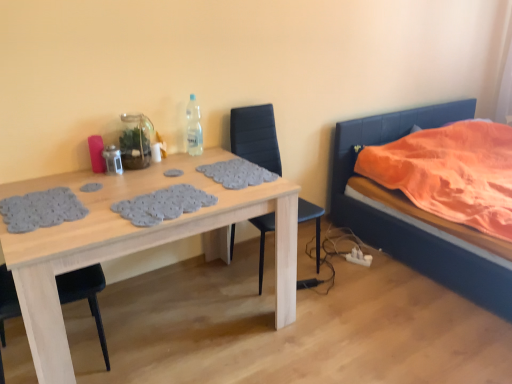
Measure the distance between wooden table at center and camera.

The distance of wooden table at center from camera is 1.38 meters.

The height and width of the screenshot is (384, 512). Describe the element at coordinates (407, 224) in the screenshot. I see `orange fabric bed at right` at that location.

What do you see at coordinates (194, 128) in the screenshot? I see `clear plastic bottle at upper center` at bounding box center [194, 128].

Where is `wooden table at center`? The image size is (512, 384). wooden table at center is located at coordinates (134, 242).

Is wooden table at center not inside clear plastic bottle at upper center?

Absolutely, wooden table at center is external to clear plastic bottle at upper center.

Is wooden table at center oriented towards clear plastic bottle at upper center?

No, wooden table at center is not turned towards clear plastic bottle at upper center.

From a real-world perspective, which object stands above the other?

clear plastic bottle at upper center is physically above.

Is black leather chair at center located outside clear plastic bottle at upper center?

Yes, black leather chair at center is not within clear plastic bottle at upper center.

Considering the sizes of objects black leather chair at center and clear plastic bottle at upper center in the image provided, who is wider, black leather chair at center or clear plastic bottle at upper center?

black leather chair at center is wider.

Is black leather chair at center taller or shorter than clear plastic bottle at upper center?

black leather chair at center is taller than clear plastic bottle at upper center.

In order to click on bottle that is above the black leather chair at center (from a real-world perspective) in this screenshot , I will do `click(194, 128)`.

Is wooden table at center surrounded by orange fabric bed at right?

Definitely not — wooden table at center is not inside orange fabric bed at right.

Is orange fabric bed at right positioned behind wooden table at center?

Yes, orange fabric bed at right is behind wooden table at center.

Is orange fabric bed at right shorter than wooden table at center?

No.

From a real-world perspective, is orange fabric bed at right positioned under wooden table at center based on gravity?

No, from a real-world perspective, orange fabric bed at right is not beneath wooden table at center.

Which object is thinner, clear plastic bottle at upper center or wooden table at center?

Thinner between the two is clear plastic bottle at upper center.

Which point is more distant from viewer, (194, 144) or (267, 184)?

Positioned behind is point (194, 144).

Which object is more forward, clear plastic bottle at upper center or wooden table at center?

wooden table at center is in front.

Is clear plastic bottle at upper center taller than wooden table at center?

Incorrect, the height of clear plastic bottle at upper center is not larger of that of wooden table at center.

Considering the sizes of objects orange fabric bed at right and black leather chair at center in the image provided, who is taller, orange fabric bed at right or black leather chair at center?

Result: black leather chair at center.

You are a GUI agent. You are given a task and a screenshot of the screen. Output one action in this format:
    pyautogui.click(x=<x>, y=<y>)
    Task: Click on the chair that is above the orange fabric bed at right (from a real-world perspective)
    This screenshot has width=512, height=384.
    Given the screenshot: What is the action you would take?
    pyautogui.click(x=255, y=136)

Which point is more forward, (458, 254) or (304, 282)?

The point (458, 254) is closer.

Measure the distance from orange fabric bed at right to black leather chair at center.

33.06 inches.

Is wooden table at center next to orange fabric bed at right?

wooden table at center and orange fabric bed at right are clearly separated.

Is wooden table at center positioned with its back to orange fabric bed at right?

No, wooden table at center is not facing away from orange fabric bed at right.

From the image's perspective, is black leather chair at center positioned above or below orange fabric bed at right?

black leather chair at center is situated lower than orange fabric bed at right in the image.

Which object is more forward, black leather chair at center or orange fabric bed at right?

orange fabric bed at right.

The width and height of the screenshot is (512, 384). Find the location of `chair behind the orange fabric bed at right`. chair behind the orange fabric bed at right is located at coordinates (255, 136).

Is orange fabric bed at right at the back of black leather chair at center?

black leather chair at center is not turned away from orange fabric bed at right.

Locate an element on the screen. table that is under the clear plastic bottle at upper center (from a real-world perspective) is located at coordinates (134, 242).

In the image, there is a black leather chair at center. Where is `bottle above it (from the image's perspective)`? The image size is (512, 384). bottle above it (from the image's perspective) is located at coordinates (194, 128).

Estimate the real-world distances between objects in this image. Which object is closer to black leather chair at center, wooden table at center or clear plastic bottle at upper center?

The object closer to black leather chair at center is clear plastic bottle at upper center.

From the image, which object appears to be nearer to wooden table at center, clear plastic bottle at upper center or orange fabric bed at right?

Based on the image, clear plastic bottle at upper center appears to be nearer to wooden table at center.

From the image, which object appears to be farther from black leather chair at center, orange fabric bed at right or clear plastic bottle at upper center?

orange fabric bed at right.

In the scene shown: Looking at the image, which one is located further to clear plastic bottle at upper center, orange fabric bed at right or black leather chair at center?

orange fabric bed at right lies further to clear plastic bottle at upper center than the other object.

Looking at this image, estimate the real-world distances between objects in this image. Which object is closer to clear plastic bottle at upper center, wooden table at center or black leather chair at center?

black leather chair at center is closer to clear plastic bottle at upper center.

Looking at the image, which one is located closer to wooden table at center, black leather chair at center or clear plastic bottle at upper center?

clear plastic bottle at upper center.

When comparing their distances from clear plastic bottle at upper center, does orange fabric bed at right or wooden table at center seem closer?

wooden table at center lies closer to clear plastic bottle at upper center than the other object.

Looking at this image, estimate the real-world distances between objects in this image. Which object is closer to orange fabric bed at right, wooden table at center or black leather chair at center?

The object closer to orange fabric bed at right is black leather chair at center.

The image size is (512, 384). Find the location of `chair between clear plastic bottle at upper center and orange fabric bed at right`. chair between clear plastic bottle at upper center and orange fabric bed at right is located at coordinates (255, 136).

Locate an element on the screen. The image size is (512, 384). bottle between wooden table at center and orange fabric bed at right is located at coordinates (194, 128).

Where is `chair situated between wooden table at center and orange fabric bed at right from left to right`? chair situated between wooden table at center and orange fabric bed at right from left to right is located at coordinates (255, 136).

Image resolution: width=512 pixels, height=384 pixels. Find the location of `chair located between wooden table at center and clear plastic bottle at upper center in the depth direction`. chair located between wooden table at center and clear plastic bottle at upper center in the depth direction is located at coordinates (255, 136).